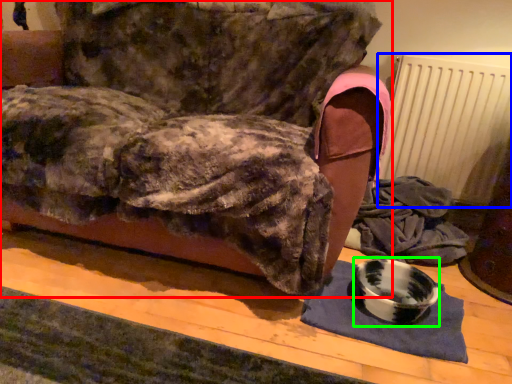
Question: Which object is positioned farthest from furniture (highlighted by a red box)? Select from radiator (highlighted by a blue box) and bowl (highlighted by a green box).

Choices:
 (A) radiator
 (B) bowl

Answer: (A)